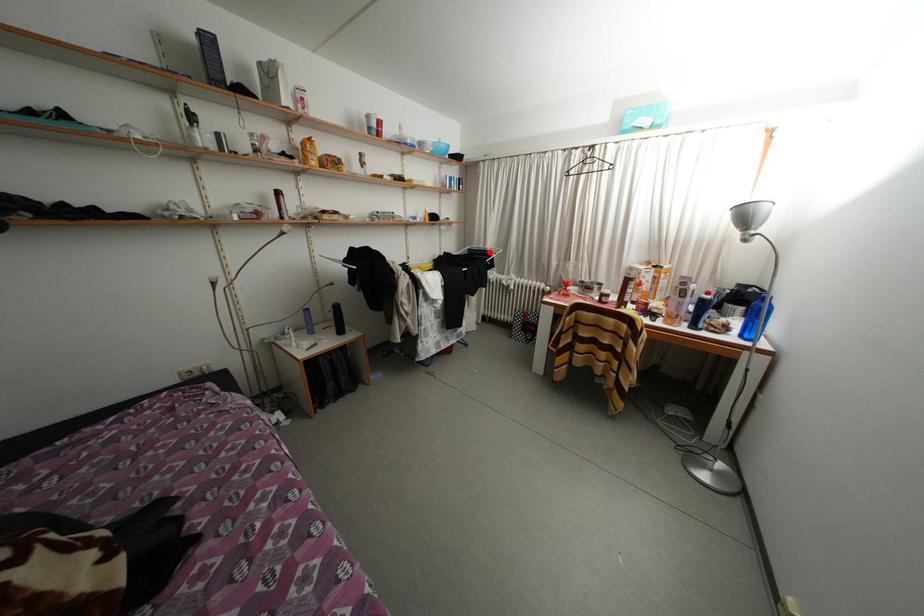
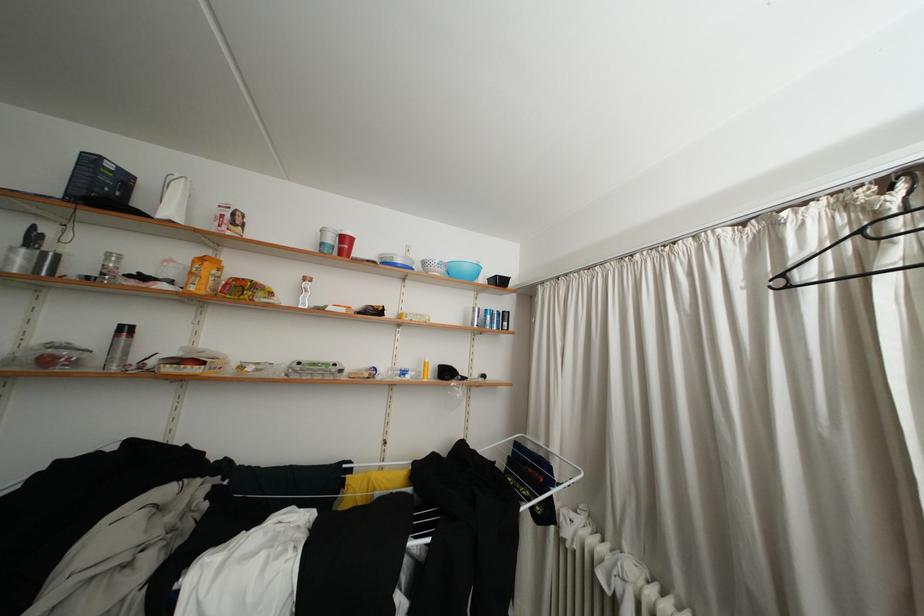
Question: I am providing you with two images of the same scene from different viewpoints. A red point is shown in image1. For the corresponding object point in image2, is it positioned nearer or farther from the camera?

Choices:
 (A) Nearer
 (B) Farther

Answer: (B)